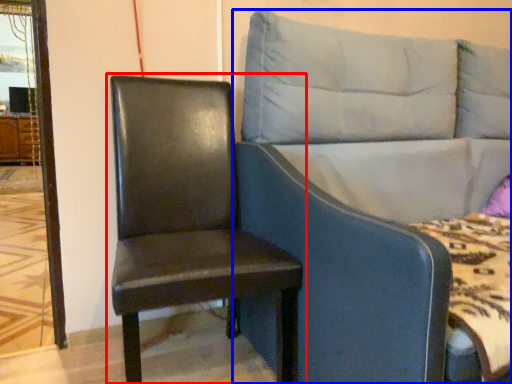
Question: Which of the following is the closest to the observer, chair (highlighted by a red box) or studio couch (highlighted by a blue box)?

Choices:
 (A) chair
 (B) studio couch

Answer: (B)